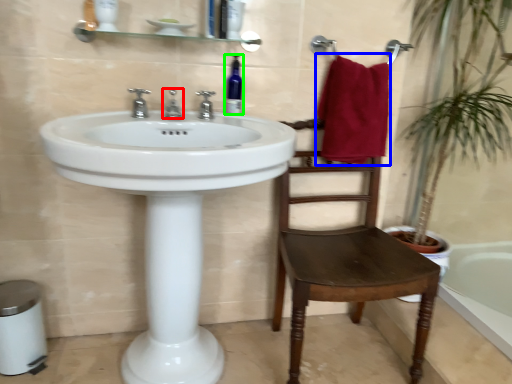
Question: Which is nearer to the tap (highlighted by a red box)? bath towel (highlighted by a blue box) or bottle (highlighted by a green box).

Choices:
 (A) bath towel
 (B) bottle

Answer: (B)